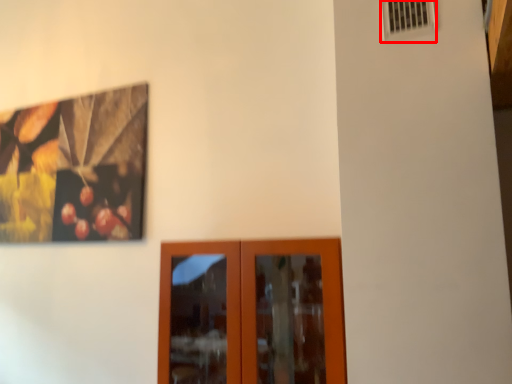
Question: Where is air conditioning (annotated by the red box) located in relation to door in the image?

Choices:
 (A) right
 (B) left

Answer: (A)